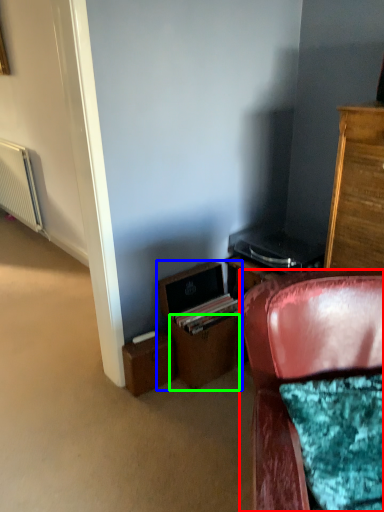
Question: Which object is positioned farthest from chair (highlighted by a red box)? Select from file cabinet (highlighted by a blue box) and drawer (highlighted by a green box).

Choices:
 (A) file cabinet
 (B) drawer

Answer: (A)